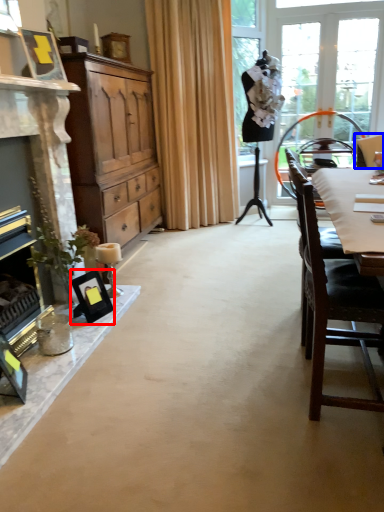
Question: Which object is closer to the camera taking this photo, picture frame (highlighted by a red box) or chair (highlighted by a blue box)?

Choices:
 (A) picture frame
 (B) chair

Answer: (A)